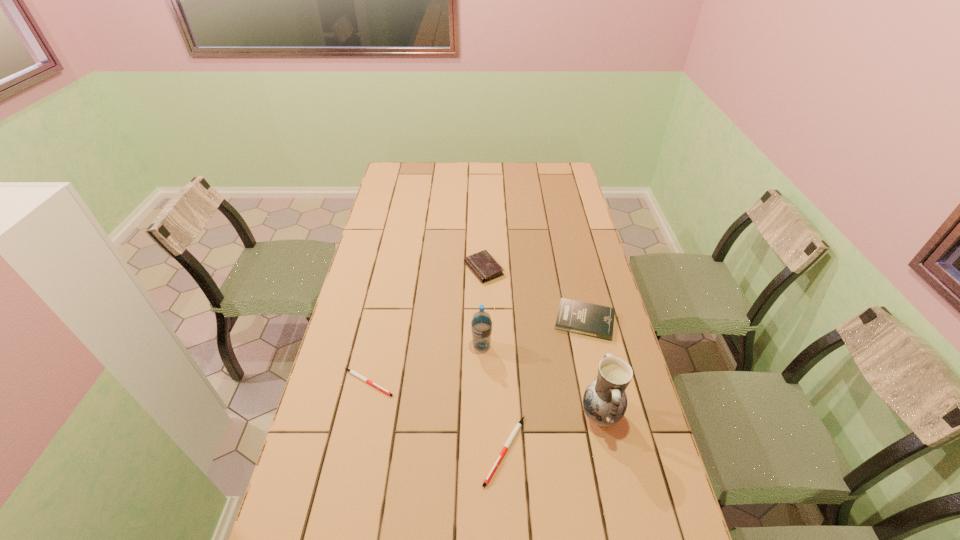
Find the location of `vacant space at the near edge`. vacant space at the near edge is located at coordinates (407, 515).

I want to click on vacant position at the left edge of the desktop, so click(x=363, y=272).

This screenshot has width=960, height=540. I want to click on free space at the right edge, so click(x=558, y=215).

Image resolution: width=960 pixels, height=540 pixels. Find the location of `free area in between the pottery and the farthest object`. free area in between the pottery and the farthest object is located at coordinates (542, 342).

The width and height of the screenshot is (960, 540). I want to click on vacant region between the pottery and the fifth shortest object, so [x=540, y=380].

At what (x,y) coordinates should I click in order to perform the action: click on free point between the pottery and the nearer pen. Please return your answer as a coordinate pair (x, y). The height and width of the screenshot is (540, 960). Looking at the image, I should click on (552, 432).

Locate an element on the screen. vacant point located between the book and the diary is located at coordinates (534, 295).

Where is `empty location between the second tallest object and the book`? This screenshot has height=540, width=960. empty location between the second tallest object and the book is located at coordinates (533, 334).

Identify the location of vacant area that lies between the fifth shortest object and the nearer pen. (493, 398).

The width and height of the screenshot is (960, 540). I want to click on vacant region between the book and the right pen, so click(544, 386).